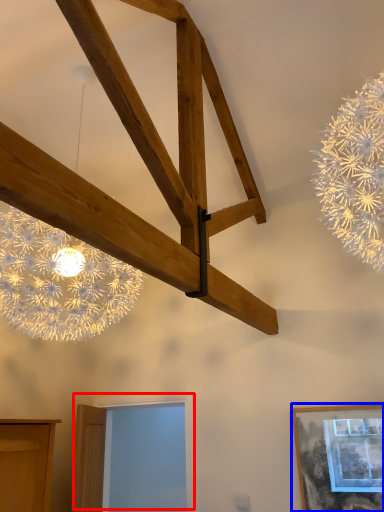
Question: Which object is further to the camera taking this photo, window (highlighted by a red box) or picture frame (highlighted by a blue box)?

Choices:
 (A) window
 (B) picture frame

Answer: (A)